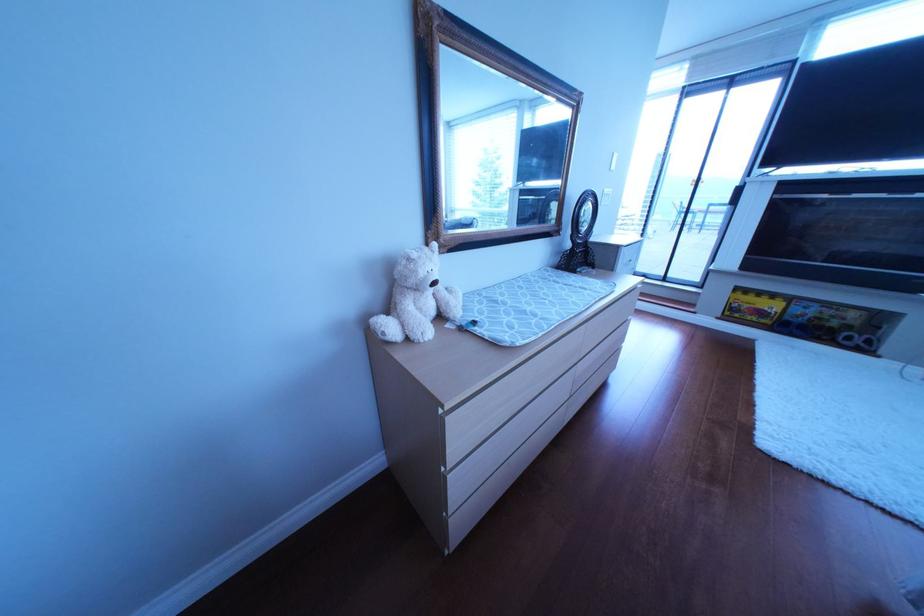
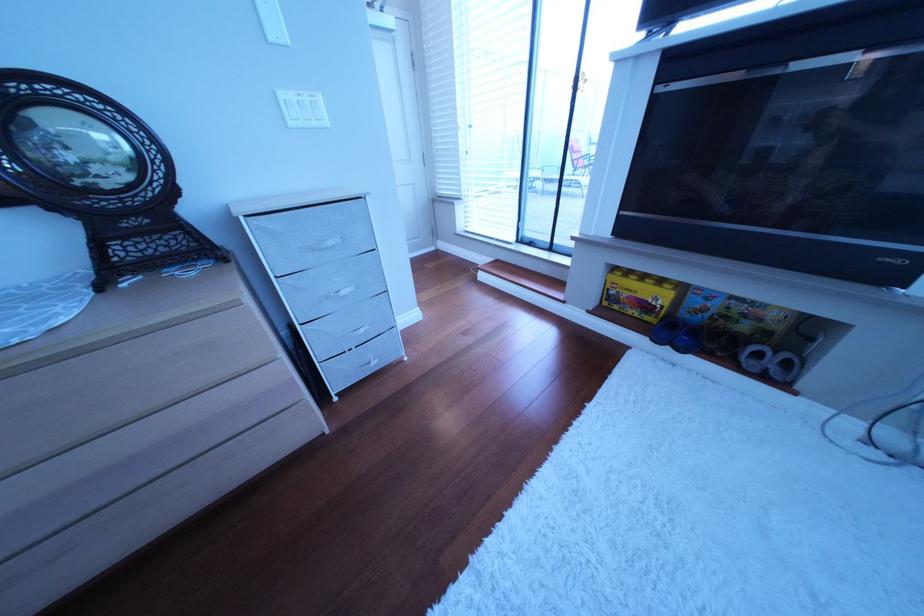
In the second image, find the point that corresponds to the point at 786,322 in the first image.

(672, 320)